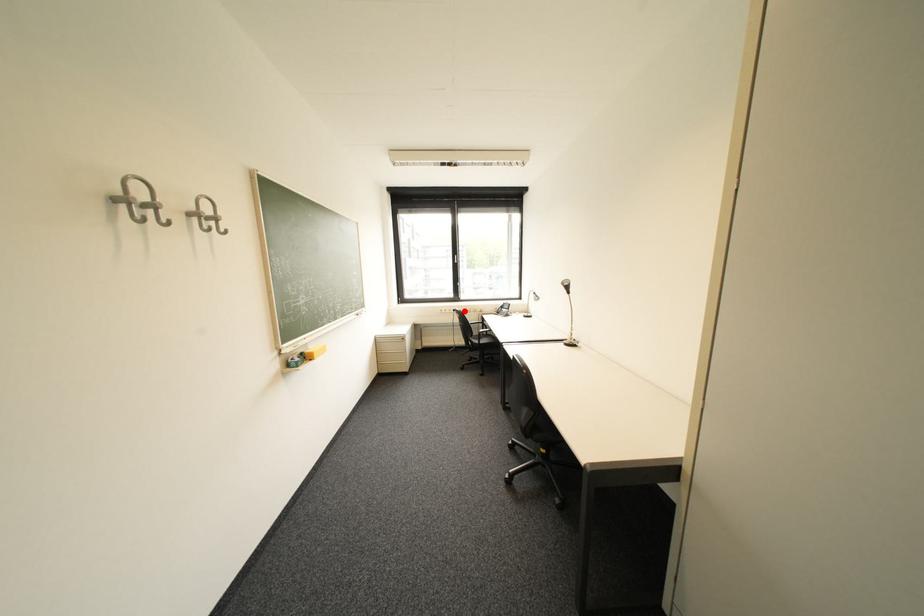
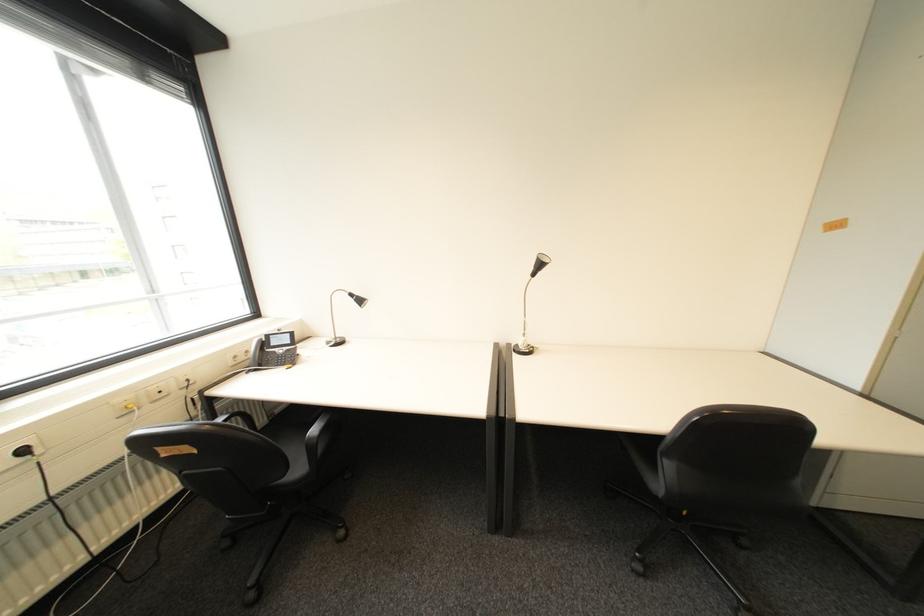
Where in the second image is the point corresponding to the highlighted location from the first image?

(34, 452)